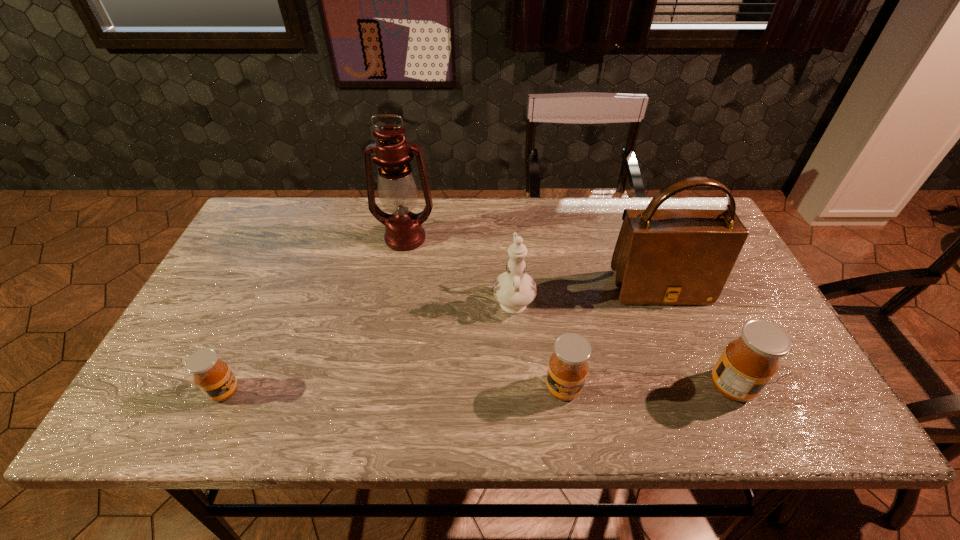
This screenshot has height=540, width=960. I want to click on vacant space situated on the front-facing side of the shortest honey, so click(335, 392).

This screenshot has width=960, height=540. Identify the location of free space located 0.070m on the front-facing side of the rightmost honey. (785, 386).

This screenshot has width=960, height=540. Find the location of `vacant space situated on the right of the oil lamp`. vacant space situated on the right of the oil lamp is located at coordinates (515, 238).

Find the location of `vacant space situated on the front flap of the shoulder bag`. vacant space situated on the front flap of the shoulder bag is located at coordinates (676, 333).

Find the location of a particular element. The image size is (960, 540). free location located 0.250m at the spout of the chinaware is located at coordinates (508, 224).

The image size is (960, 540). Find the location of `free spot located at the spout of the chinaware`. free spot located at the spout of the chinaware is located at coordinates (507, 216).

This screenshot has width=960, height=540. I want to click on vacant region located at the spout of the chinaware, so pyautogui.click(x=510, y=247).

Image resolution: width=960 pixels, height=540 pixels. In order to click on object located in the far edge section of the desktop in this screenshot , I will do `click(398, 191)`.

I want to click on object that is at the left edge, so click(214, 378).

Find the location of `honey that is at the right edge`. honey that is at the right edge is located at coordinates (748, 363).